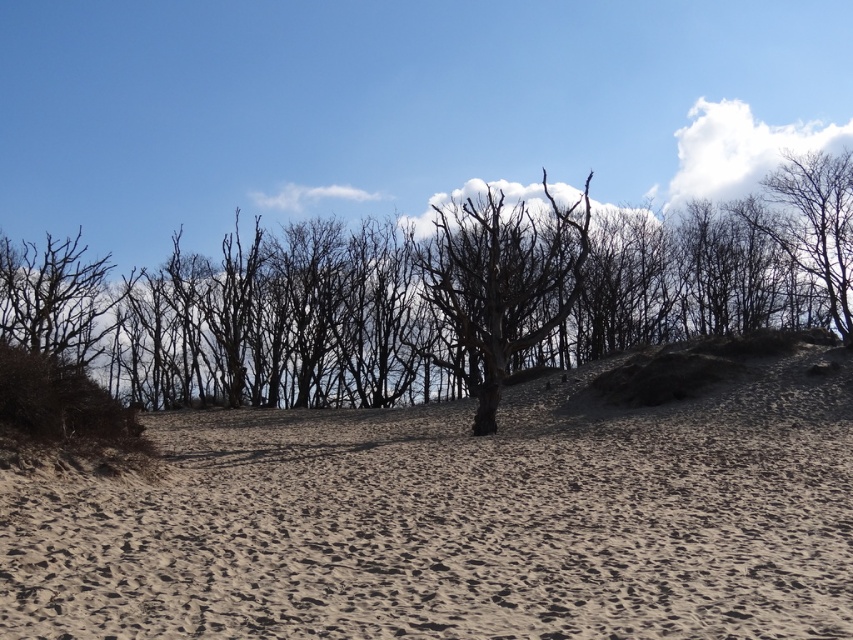
Looking at this image, does bare wood tree at center have a smaller size compared to bare branches at upper right?

Incorrect, bare wood tree at center is not smaller in size than bare branches at upper right.

Does bare wood tree at center have a larger size compared to bare branches at upper right?

Indeed, bare wood tree at center has a larger size compared to bare branches at upper right.

Who is more distant from viewer, (509,262) or (804,195)?

The point (804,195) is more distant.

This screenshot has height=640, width=853. I want to click on bare wood tree at center, so click(502, 280).

Is point (762, 209) farther from camera compared to point (807, 262)?

Yes, it is.

At what (x,y) coordinates should I click in order to perform the action: click on bare branches at center. Please return your answer as a coordinate pair (x, y). Looking at the image, I should click on (439, 296).

Find the location of a particular element. The image size is (853, 640). bare branches at center is located at coordinates (439, 296).

Does smooth beige sand at center have a larger size compared to bare branches at upper right?

Incorrect, smooth beige sand at center is not larger than bare branches at upper right.

Between smooth beige sand at center and bare branches at upper right, which one is positioned higher?

Positioned higher is bare branches at upper right.

Image resolution: width=853 pixels, height=640 pixels. In order to click on smooth beige sand at center in this screenshot , I will do tap(457, 522).